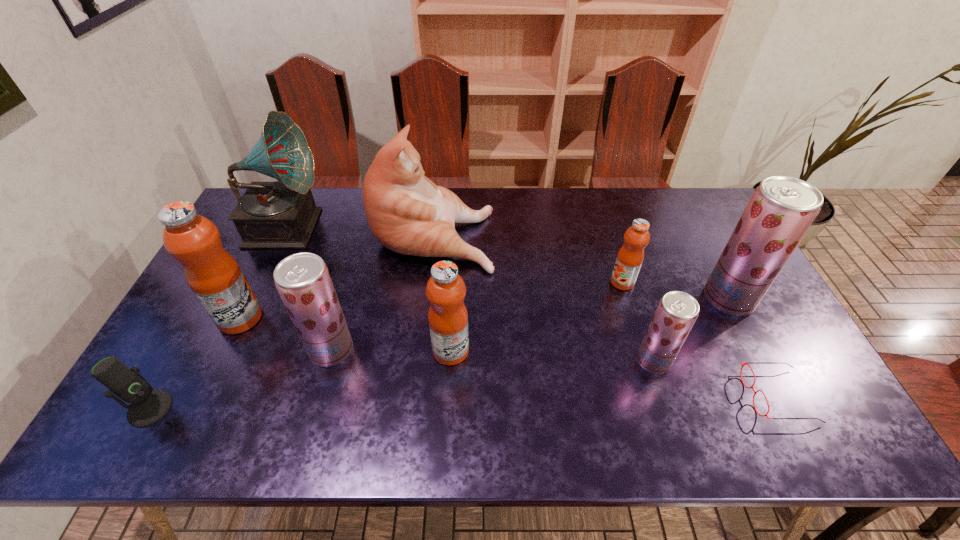
Where is `object situated at the near left corner`? object situated at the near left corner is located at coordinates (148, 406).

Find the location of a particular element. object that is at the near right corner is located at coordinates (747, 363).

Find the location of `vacant space at the near edge`. vacant space at the near edge is located at coordinates [x=666, y=424].

What are the coordinates of `free space at the right edge of the desktop` in the screenshot? It's located at (769, 386).

The height and width of the screenshot is (540, 960). I want to click on vacant region at the near right corner, so click(x=816, y=411).

Identify the location of vacant point located between the rightmost orange fruit juice and the orange cat. Image resolution: width=960 pixels, height=540 pixels. (528, 258).

Find the location of a particular element. free space between the spectacles and the farthest strawberry fruit juice is located at coordinates (753, 347).

What are the coordinates of `vacant space that's between the fourth fruit juice from right to left and the rightmost orange fruit juice` in the screenshot? It's located at (537, 316).

Where is `free space between the second fruit juice from left to right and the second shortest object`? This screenshot has width=960, height=540. free space between the second fruit juice from left to right and the second shortest object is located at coordinates (241, 379).

Where is `free space that is in between the ninth tallest object and the spectacles`? free space that is in between the ninth tallest object and the spectacles is located at coordinates (464, 402).